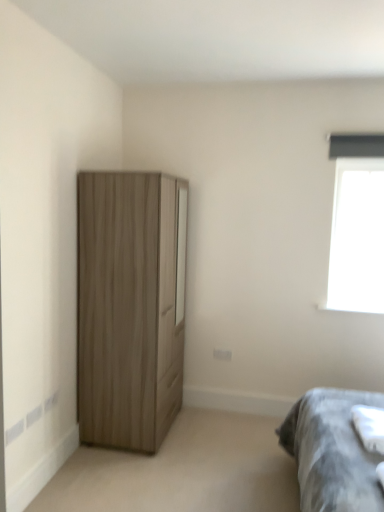
The image size is (384, 512). In order to click on free location to the right of wooden wardrobe at left in this screenshot , I will do `click(214, 439)`.